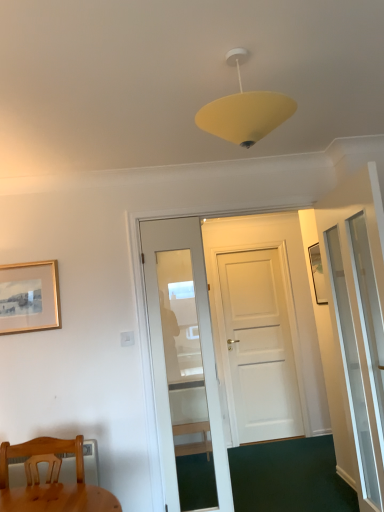
Question: Considering the relative sizes of wooden chair at lower left and transparent glass screen door at right in the image provided, is wooden chair at lower left shorter than transparent glass screen door at right?

Choices:
 (A) yes
 (B) no

Answer: (A)

Question: Does wooden chair at lower left appear on the right side of transparent glass screen door at right?

Choices:
 (A) no
 (B) yes

Answer: (A)

Question: Is wooden chair at lower left far from transparent glass screen door at right?

Choices:
 (A) no
 (B) yes

Answer: (B)

Question: Is wooden chair at lower left positioned in front of transparent glass screen door at right?

Choices:
 (A) no
 (B) yes

Answer: (B)

Question: Are wooden chair at lower left and transparent glass screen door at right beside each other?

Choices:
 (A) no
 (B) yes

Answer: (A)

Question: From a real-world perspective, is wooden chair at lower left beneath transparent glass screen door at right?

Choices:
 (A) yes
 (B) no

Answer: (A)

Question: Is wooden chair at lower left facing towards gold metallic picture frame at upper left?

Choices:
 (A) yes
 (B) no

Answer: (B)

Question: Is wooden chair at lower left smaller than gold metallic picture frame at upper left?

Choices:
 (A) yes
 (B) no

Answer: (B)

Question: Considering the relative sizes of wooden chair at lower left and gold metallic picture frame at upper left in the image provided, is wooden chair at lower left bigger than gold metallic picture frame at upper left?

Choices:
 (A) no
 (B) yes

Answer: (B)

Question: Is wooden chair at lower left thinner than gold metallic picture frame at upper left?

Choices:
 (A) yes
 (B) no

Answer: (B)

Question: From the image's perspective, is wooden chair at lower left under gold metallic picture frame at upper left?

Choices:
 (A) no
 (B) yes

Answer: (B)

Question: Is wooden chair at lower left wider than gold metallic picture frame at upper left?

Choices:
 (A) yes
 (B) no

Answer: (A)

Question: Is transparent glass screen door at right to the right of gold metallic picture frame at upper left from the viewer's perspective?

Choices:
 (A) yes
 (B) no

Answer: (A)